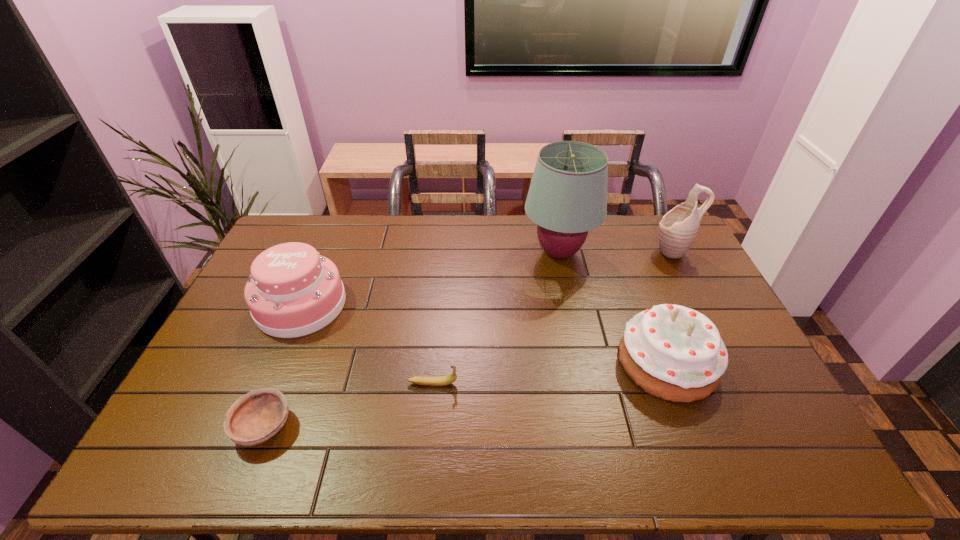
The height and width of the screenshot is (540, 960). I want to click on vacant space situated 0.180m at the spout of the pitcher, so click(x=603, y=252).

This screenshot has width=960, height=540. Identify the location of free spot located on the back of the left cake. (335, 223).

Locate an element on the screen. The width and height of the screenshot is (960, 540). free space located on the left of the right cake is located at coordinates (497, 362).

In order to click on vacant space located at the stem of the fifth tallest object in this screenshot , I will do `click(520, 383)`.

Locate an element on the screen. The height and width of the screenshot is (540, 960). free space located on the back of the bowl is located at coordinates (311, 307).

Find the location of a particular element. The height and width of the screenshot is (540, 960). lampshade that is at the far edge is located at coordinates (567, 197).

What are the coordinates of `pitcher present at the far edge` in the screenshot? It's located at coord(677,230).

Locate an element on the screen. object located at the near edge is located at coordinates (254, 418).

Find the location of a particular element. The height and width of the screenshot is (540, 960). cake positioned at the left edge is located at coordinates (292, 291).

Where is `bowl at the left edge`? The height and width of the screenshot is (540, 960). bowl at the left edge is located at coordinates (254, 418).